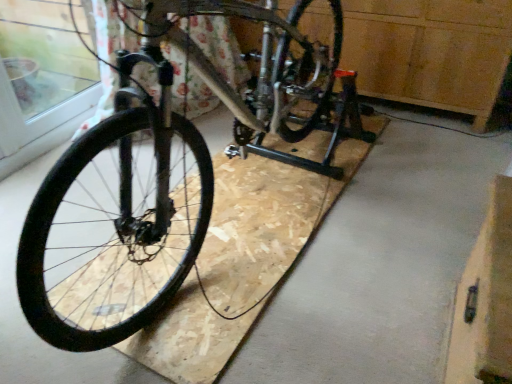
I want to click on matte black bicycle at center, so click(x=164, y=177).

The image size is (512, 384). Describe the element at coordinates (164, 177) in the screenshot. I see `matte black bicycle at center` at that location.

Based on the photo, in order to face matte black bicycle at center, should I rotate leftwards or rightwards?

A 1.668 degree turn to the left will do.

Find the location of `matte black bicycle at center`. matte black bicycle at center is located at coordinates (164, 177).